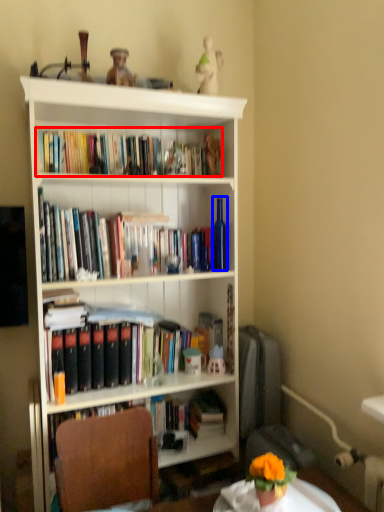
Question: Which point is closer to the camera, book (highlighted by a red box) or bottle (highlighted by a blue box)?

Choices:
 (A) book
 (B) bottle

Answer: (A)